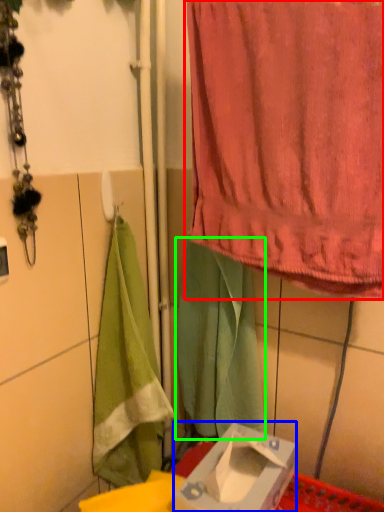
Question: Which is nearer to the curtain (highlighted by a red box)? box (highlighted by a blue box) or cloth (highlighted by a green box).

Choices:
 (A) box
 (B) cloth

Answer: (B)